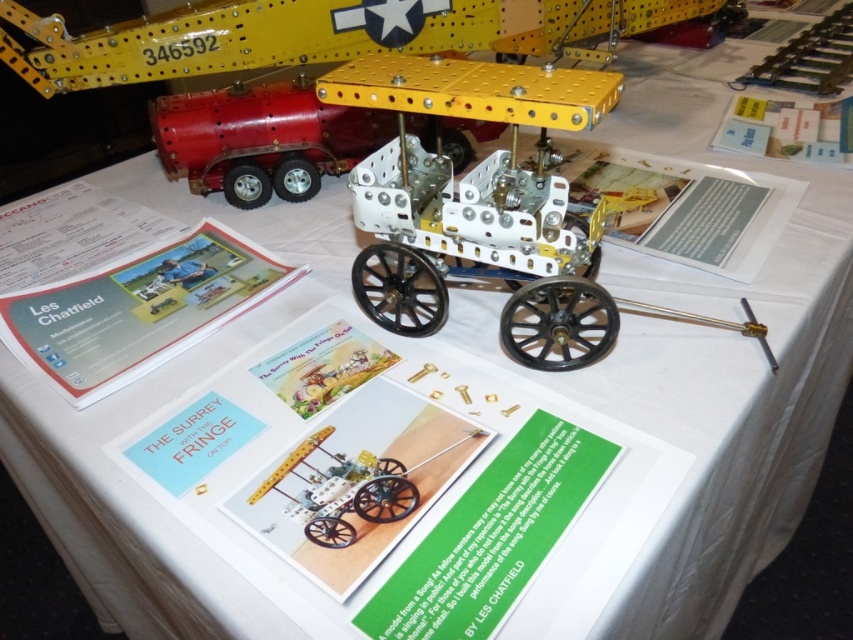
Question: Among these points, which one is nearest to the camera?

Choices:
 (A) (235, 186)
 (B) (509, 342)

Answer: (B)

Question: Can you confirm if metallic yellow frame at center is positioned to the left of metallic red trailer at upper left?

Choices:
 (A) no
 (B) yes

Answer: (A)

Question: Does metallic yellow frame at center have a larger size compared to metallic red trailer at upper left?

Choices:
 (A) yes
 (B) no

Answer: (A)

Question: Is metallic yellow frame at center above metallic red trailer at upper left?

Choices:
 (A) no
 (B) yes

Answer: (A)

Question: Which of the following is the farthest from the observer?

Choices:
 (A) coord(397,60)
 (B) coord(196,120)

Answer: (B)